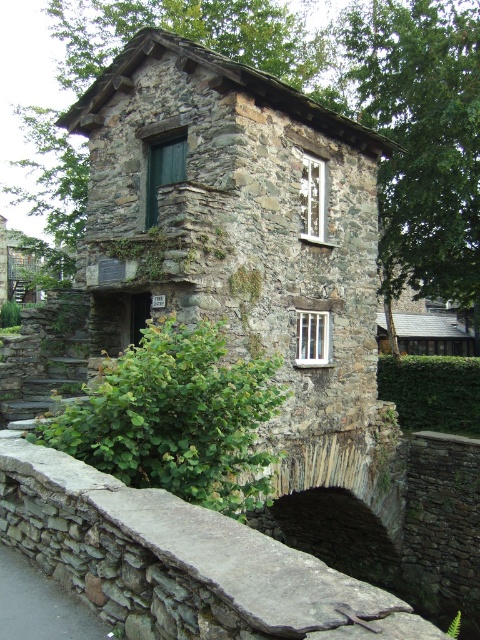
You are standing in front of the historic building described in the scene. You see a gray stone ledge at center and a green leafy hedge at lower left. Which object is positioned higher relative to the other?

The gray stone ledge at center is located below the green leafy hedge at lower left, meaning the hedge is higher up than the ledge.

You are standing in front of the historic stone building and notice two green leafy hedges. One is the green leafy hedge at lower left and the other is the green leafy hedge at lower center. Which hedge is positioned to the left of the other?

The green leafy hedge at lower left is positioned to the left of the green leafy hedge at lower center.